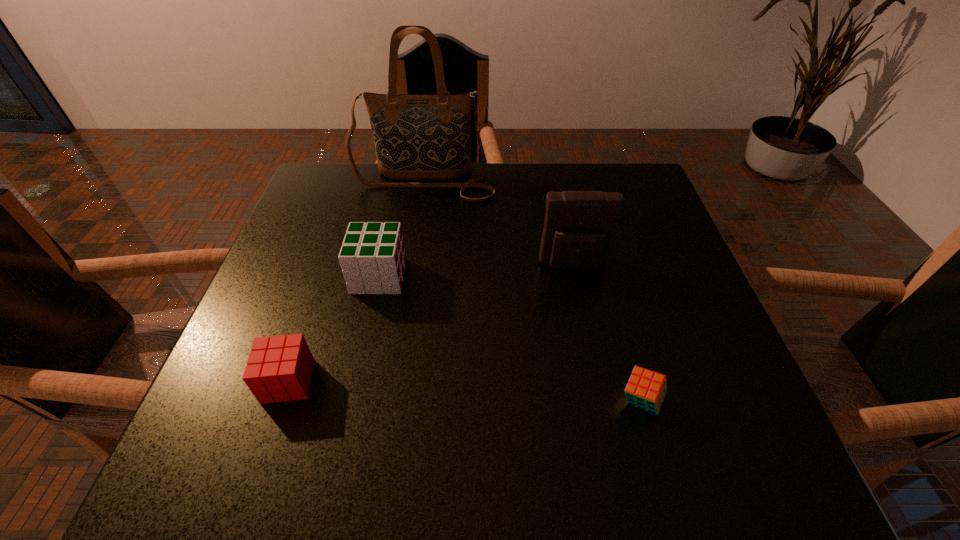
You are a GUI agent. You are given a task and a screenshot of the screen. Output one action in this format:
    pyautogui.click(x=<x>, y=<y>)
    Task: Click on the vacant region located on the back of the leftmost cube
    The height and width of the screenshot is (540, 960).
    Given the screenshot: What is the action you would take?
    pyautogui.click(x=337, y=238)

Where is `vacant space located on the right of the rightmost cube`? This screenshot has height=540, width=960. vacant space located on the right of the rightmost cube is located at coordinates (735, 401).

Identify the location of object located at the far edge. (417, 136).

The height and width of the screenshot is (540, 960). I want to click on handbag at the left edge, so pos(417,136).

The image size is (960, 540). In order to click on cube that is at the left edge in this screenshot , I will do `click(279, 368)`.

This screenshot has height=540, width=960. What are the coordinates of `object at the right edge` in the screenshot? It's located at (646, 389).

This screenshot has width=960, height=540. What are the coordinates of `object situated at the far left corner` in the screenshot? It's located at (417, 136).

At what (x,y) coordinates should I click in order to perform the action: click on free space at the far edge of the desktop. Please return your answer as a coordinate pair (x, y). Looking at the image, I should click on (373, 188).

Image resolution: width=960 pixels, height=540 pixels. What are the coordinates of `free space at the near edge of the desktop` in the screenshot? It's located at (628, 424).

The height and width of the screenshot is (540, 960). In the image, there is a desktop. Identify the location of free space at the left edge. (337, 217).